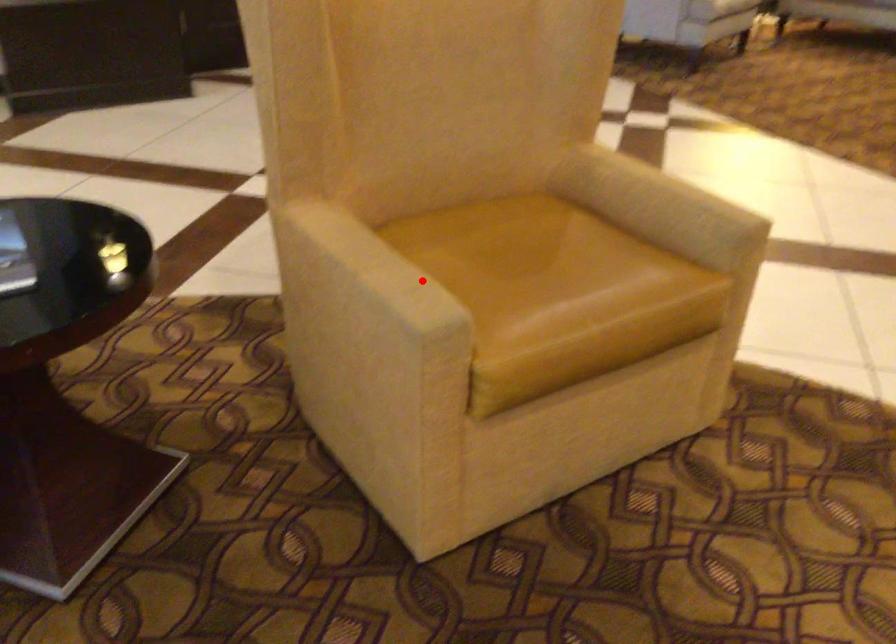
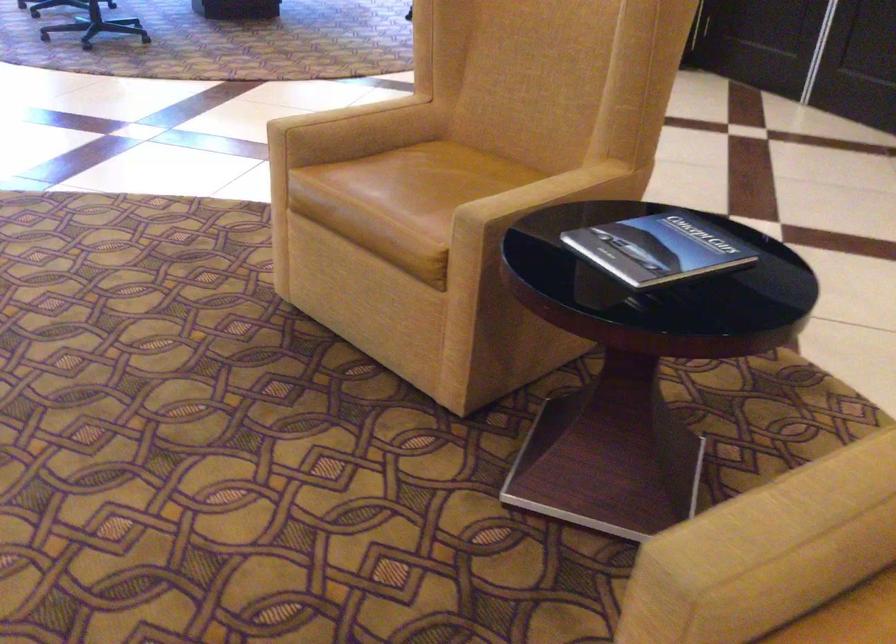
Question: I am providing you with two images of the same scene from different viewpoints. In image1, a red point is highlighted. Considering the same 3D point in image2, which of the following is correct?

Choices:
 (A) It is closer
 (B) It is farther

Answer: (A)